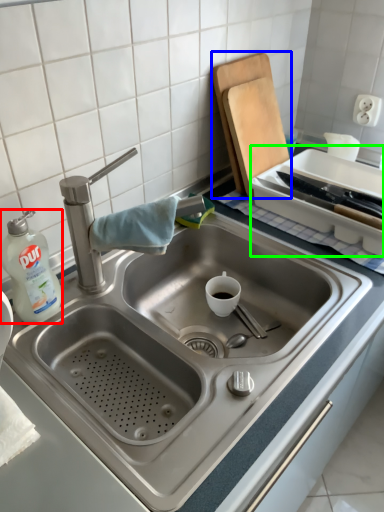
Question: Estimate the real-world distances between objects in this image. Which object is closer to cleaning product (highlighted by a red box), cutting board (highlighted by a blue box) or appliance (highlighted by a green box)?

Choices:
 (A) cutting board
 (B) appliance

Answer: (A)